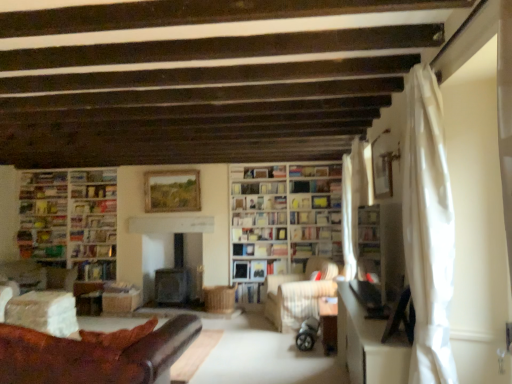
Question: Is white paper bookshelf at center, acting as the 4th book starting from the left, oriented away from white sheer curtain at right, acting as the 3th curtain starting from the back?

Choices:
 (A) yes
 (B) no

Answer: (B)

Question: Could you tell me if white paper bookshelf at center, the fourth book viewed from the right, is turned towards white sheer curtain at right, which appears as the first curtain when viewed from the front?

Choices:
 (A) no
 (B) yes

Answer: (B)

Question: Can you confirm if white paper bookshelf at center, the fourth book viewed from the right, is positioned to the right of white sheer curtain at right, which appears as the first curtain when viewed from the front?

Choices:
 (A) yes
 (B) no

Answer: (B)

Question: Is white paper bookshelf at center, the fourth book viewed from the right, closer to camera compared to white sheer curtain at right, acting as the 3th curtain starting from the back?

Choices:
 (A) yes
 (B) no

Answer: (B)

Question: From a real-world perspective, is white paper bookshelf at center, the fourth book viewed from the right, physically below white sheer curtain at right, acting as the 3th curtain starting from the back?

Choices:
 (A) no
 (B) yes

Answer: (A)

Question: Is hardcover book at center, the 3th book from the right, inside the boundaries of white sheer curtain at right, the 2th curtain in the back-to-front sequence, or outside?

Choices:
 (A) outside
 (B) inside

Answer: (A)

Question: Would you say hardcover book at center, which is the 5th book from left to right, is to the left or to the right of white sheer curtain at right, the 2th curtain from the front, in the picture?

Choices:
 (A) right
 (B) left

Answer: (B)

Question: From a real-world perspective, is hardcover book at center, which is the 5th book from left to right, positioned above or below white sheer curtain at right, the 2th curtain in the back-to-front sequence?

Choices:
 (A) above
 (B) below

Answer: (B)

Question: Considering their positions, is hardcover book at center, the 3th book from the right, located in front of or behind white sheer curtain at right, the 2th curtain in the back-to-front sequence?

Choices:
 (A) front
 (B) behind

Answer: (B)

Question: Is wooden bookshelf at center, arranged as the second shelf when viewed from the top, to the left or to the right of white sheer curtain at right, which appears as the first curtain when viewed from the front, in the image?

Choices:
 (A) right
 (B) left

Answer: (B)

Question: Is wooden bookshelf at center, which is the 1th shelf from left to right, taller or shorter than white sheer curtain at right, which appears as the first curtain when viewed from the front?

Choices:
 (A) short
 (B) tall

Answer: (A)

Question: From a real-world perspective, relative to white sheer curtain at right, which appears as the first curtain when viewed from the front, is wooden bookshelf at center, the third shelf when ordered from front to back, vertically above or below?

Choices:
 (A) above
 (B) below

Answer: (A)

Question: Is wooden bookshelf at center, the 1th shelf positioned from the back, spatially inside white sheer curtain at right, which appears as the first curtain when viewed from the front, or outside of it?

Choices:
 (A) outside
 (B) inside

Answer: (A)

Question: Based on their sizes in the image, would you say hardcover book at center, which is counted as the first book, starting from the right, is bigger or smaller than hardcover book at center, the 3th book from the right?

Choices:
 (A) big
 (B) small

Answer: (B)

Question: From a real-world perspective, is hardcover book at center, the seventh book when ordered from left to right, positioned above or below hardcover book at center, which is the 5th book from left to right?

Choices:
 (A) above
 (B) below

Answer: (B)